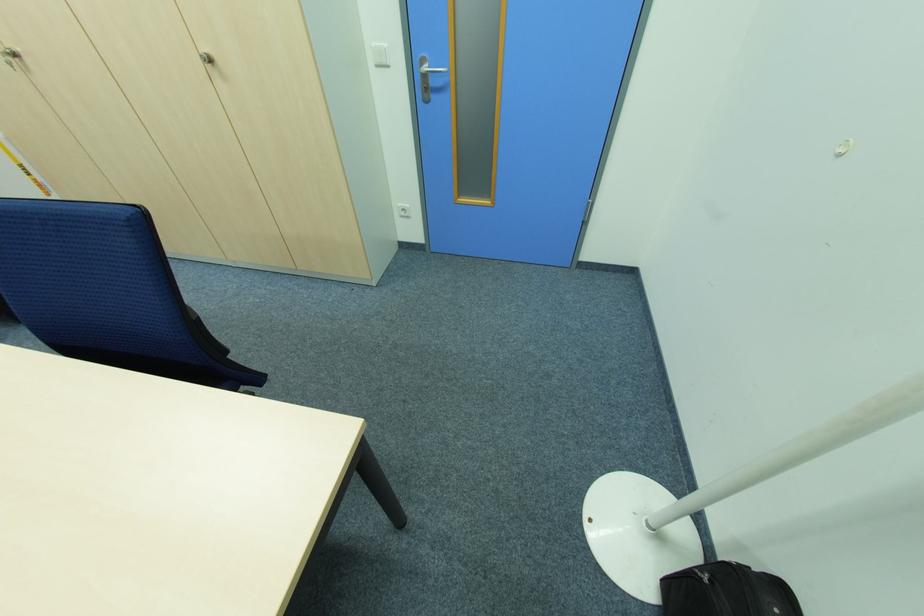
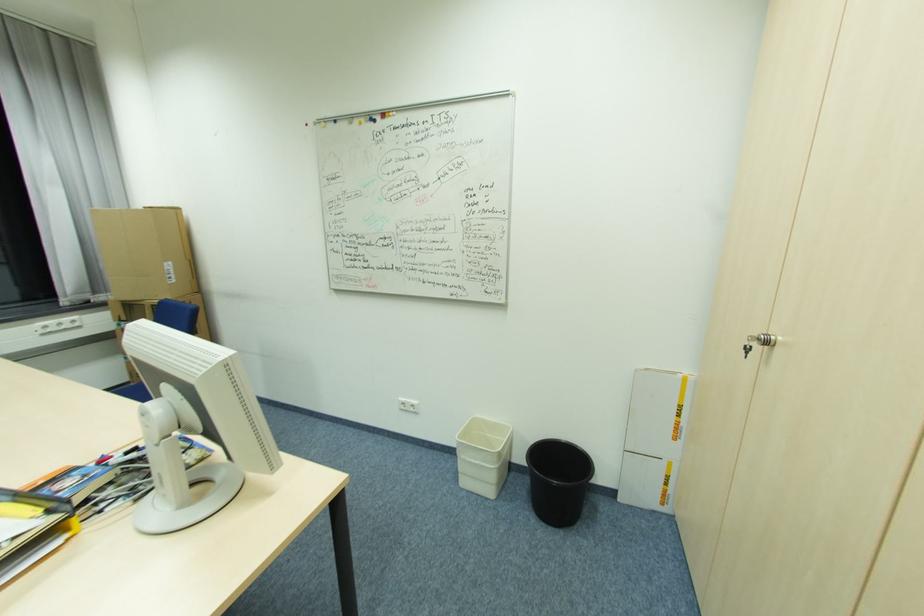
Find the pixel in the second image that matches point (43, 185) in the first image.

(681, 430)